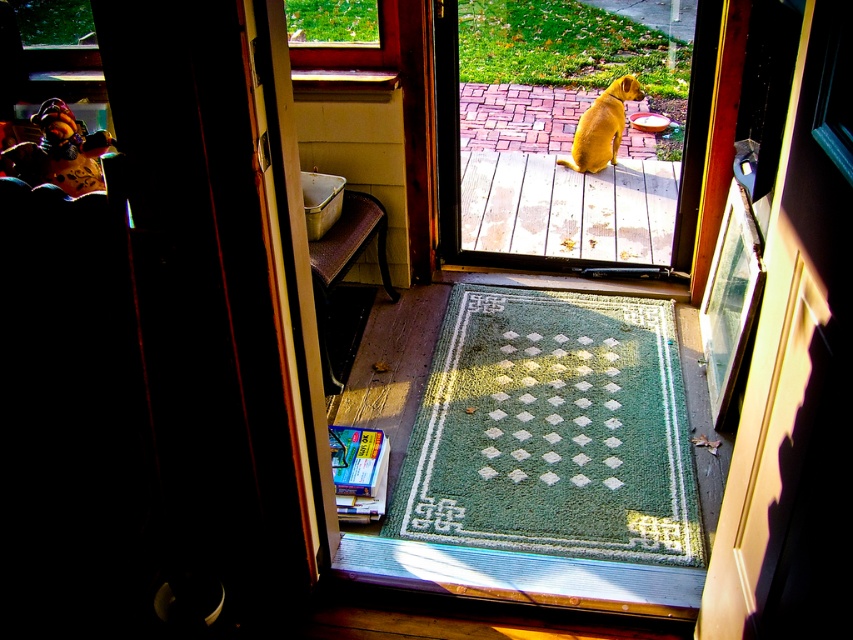
You are standing inside the house near the wooden chair with a dark cushioned seat. You want to step onto the green textured doormat at center outside. Based on the coordinates provided, is the doormat positioned directly in front of the door or to the side?

The green textured doormat at center is located at point coordinates, which places it directly in front of the door rather than to the side.

You are standing inside the house and looking through the open door to the patio. You see a yellow fur dog at center. Is the dog closer to the door or farther away from it?

The yellow fur dog at center is located at point (561,138), which means it is closer to the door since the coordinates indicate its position near the center of the visible area through the door.

You are standing inside the house and looking through the open door to the patio. You see a yellow fur dog at center and a golden fur dog at center. Which dog is closer to you?

The yellow fur dog at center is closer to you because it is in front of the golden fur dog at center.